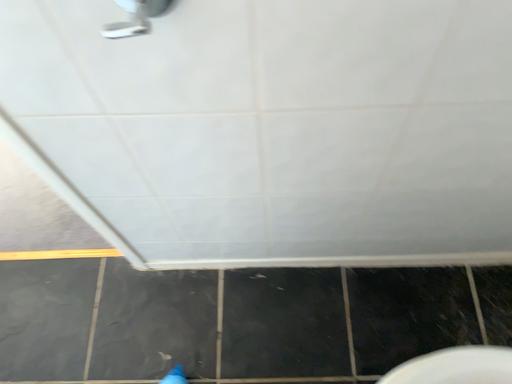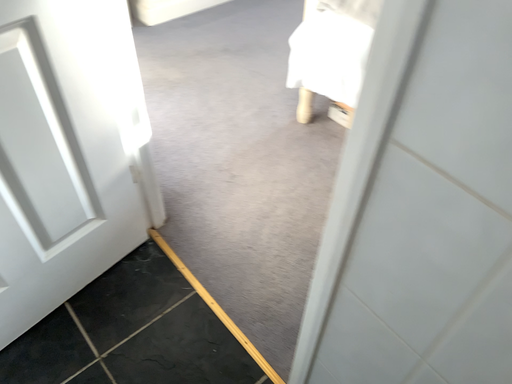
Question: Which way did the camera rotate in the video?

Choices:
 (A) rotated upward
 (B) rotated downward

Answer: (A)